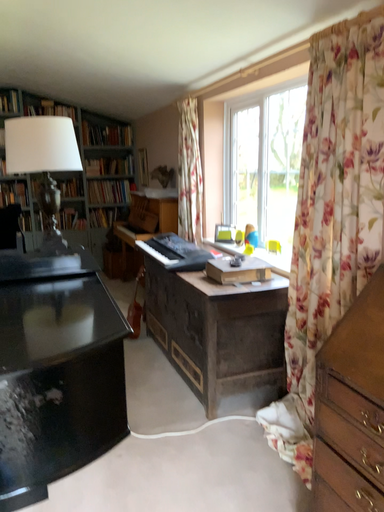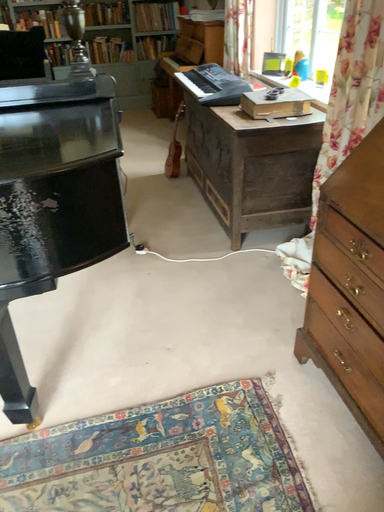
Question: How did the camera likely rotate when shooting the video?

Choices:
 (A) rotated upward
 (B) rotated downward

Answer: (B)